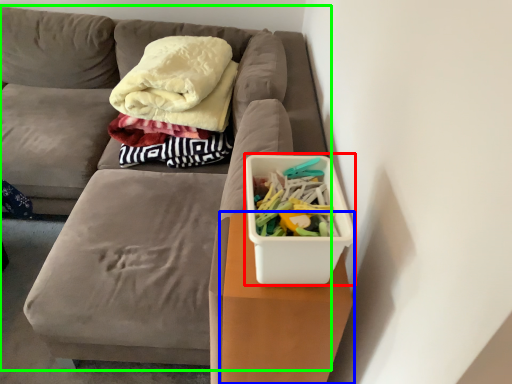
Question: Based on their relative distances, which object is nearer to storage box (highlighted by a red box)? Choose from table (highlighted by a blue box) and furniture (highlighted by a green box).

Choices:
 (A) table
 (B) furniture

Answer: (A)